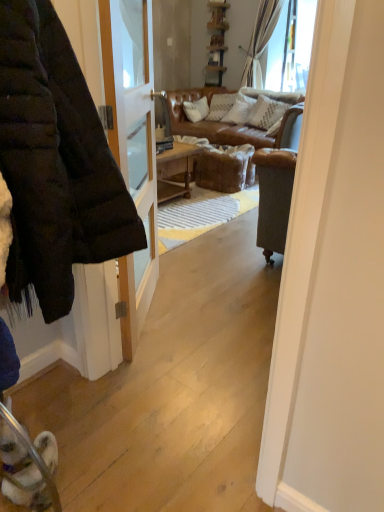
Question: Does point (29, 258) appear closer or farther from the camera than point (269, 115)?

Choices:
 (A) farther
 (B) closer

Answer: (B)

Question: From their relative heights in the image, would you say matte black jacket at left is taller or shorter than white textured pillow at center?

Choices:
 (A) short
 (B) tall

Answer: (B)

Question: From the image's perspective, is matte black jacket at left above or below white textured pillow at center?

Choices:
 (A) above
 (B) below

Answer: (B)

Question: From their relative heights in the image, would you say white textured pillow at center is taller or shorter than matte black jacket at left?

Choices:
 (A) short
 (B) tall

Answer: (A)

Question: From the image's perspective, is white textured pillow at center above or below matte black jacket at left?

Choices:
 (A) below
 (B) above

Answer: (B)

Question: From a real-world perspective, relative to matte black jacket at left, is white textured pillow at center vertically above or below?

Choices:
 (A) below
 (B) above

Answer: (A)

Question: Is white textured pillow at center bigger or smaller than matte black jacket at left?

Choices:
 (A) big
 (B) small

Answer: (B)